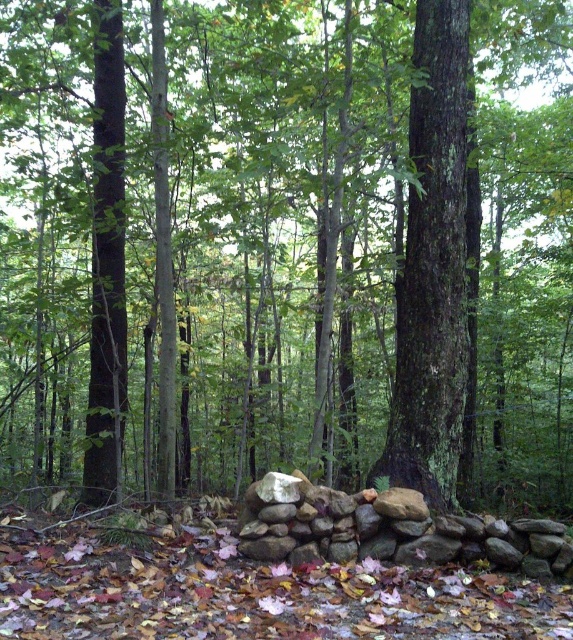
Question: Which object appears farthest from the camera in this image?

Choices:
 (A) brown rough stone wall at center
 (B) smooth bark tree at center

Answer: (B)

Question: Can you confirm if smooth bark tree at center is positioned above brown rough stone wall at center?

Choices:
 (A) yes
 (B) no

Answer: (A)

Question: Which of the following is the farthest from the observer?

Choices:
 (A) (425, 458)
 (B) (281, 481)

Answer: (A)

Question: Does smooth bark tree at center appear on the left side of brown rough stone wall at center?

Choices:
 (A) yes
 (B) no

Answer: (B)

Question: Does smooth bark tree at center have a smaller size compared to brown rough stone wall at center?

Choices:
 (A) no
 (B) yes

Answer: (A)